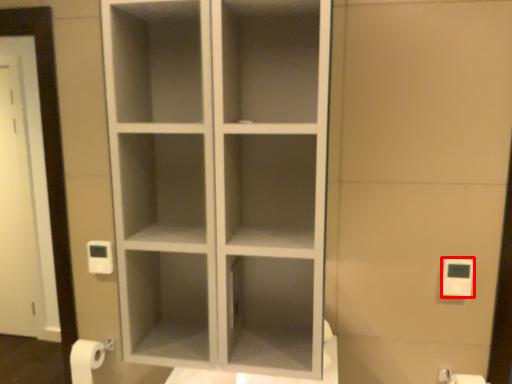
Question: From the image's perspective, considering the relative positions of light switch (annotated by the red box) and toilet paper in the image provided, where is light switch (annotated by the red box) located with respect to the staircase?

Choices:
 (A) below
 (B) above

Answer: (B)